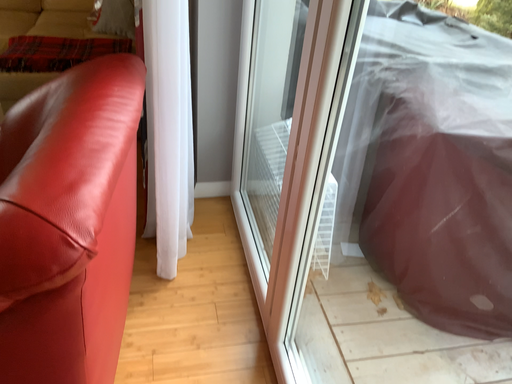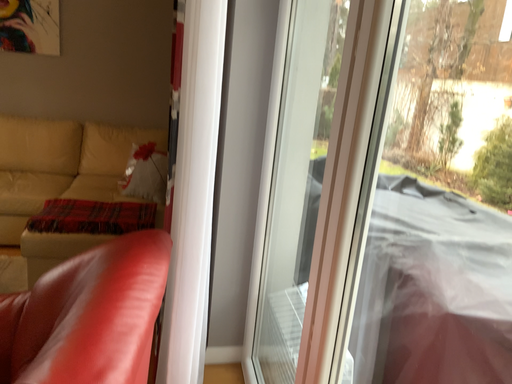
Question: Which way did the camera rotate in the video?

Choices:
 (A) rotated downward
 (B) rotated upward

Answer: (B)